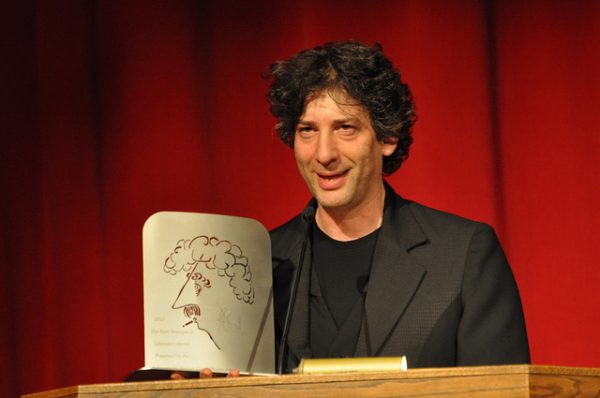
Where is `drapes`? This screenshot has width=600, height=398. drapes is located at coordinates (120, 109).